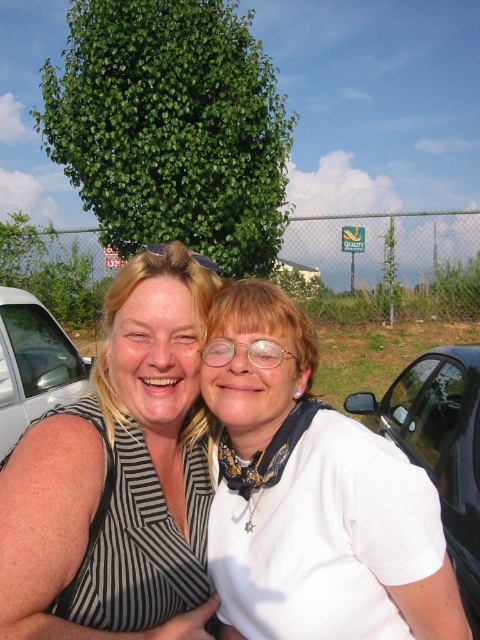
Question: Which point appears farthest from the camera in this image?

Choices:
 (A) (465, 518)
 (B) (75, 381)

Answer: (B)

Question: Is white matte shirt at center to the left of striped fabric at center from the viewer's perspective?

Choices:
 (A) yes
 (B) no

Answer: (B)

Question: From the image, what is the correct spatial relationship of white matte shirt at center in relation to black glossy car at right?

Choices:
 (A) below
 (B) above

Answer: (B)

Question: Which of the following is the farthest from the observer?

Choices:
 (A) black glossy car at right
 (B) white matte shirt at center

Answer: (A)

Question: Among these points, which one is nearest to the camera?

Choices:
 (A) (457, 481)
 (B) (12, 426)

Answer: (A)

Question: Can you confirm if striped fabric at center is bigger than black glossy car at right?

Choices:
 (A) yes
 (B) no

Answer: (B)